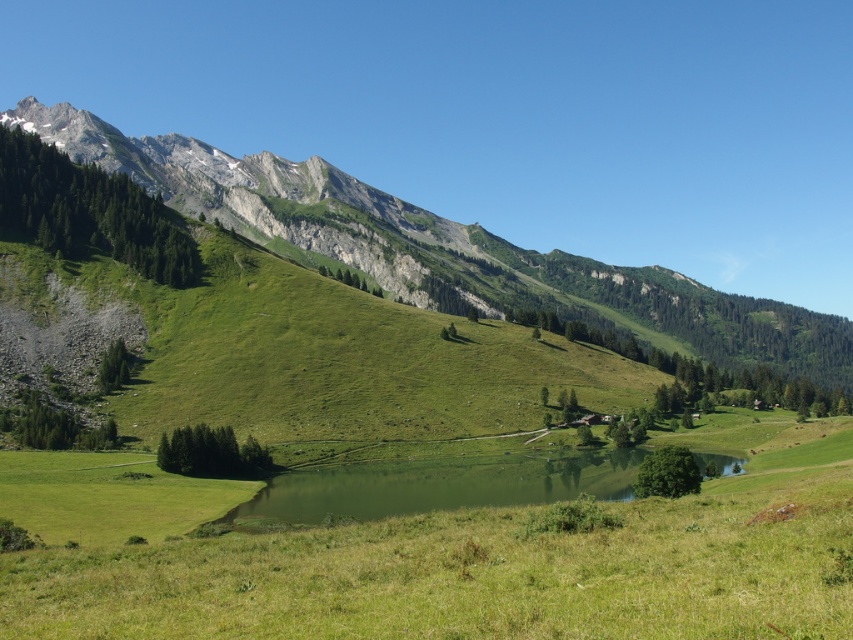
Who is positioned more to the left, green grassy hillside at upper left or green grassy lake at center?

green grassy hillside at upper left is more to the left.

From the picture: Who is more distant from viewer, (62, 125) or (532, 488)?

The point (62, 125) is behind.

Which is behind, point (88, 163) or point (363, 500)?

The point (88, 163) is more distant.

At what (x,y) coordinates should I click in order to perform the action: click on green grassy hillside at upper left. Please return your answer as a coordinate pair (x, y). The width and height of the screenshot is (853, 640). Looking at the image, I should click on (445, 248).